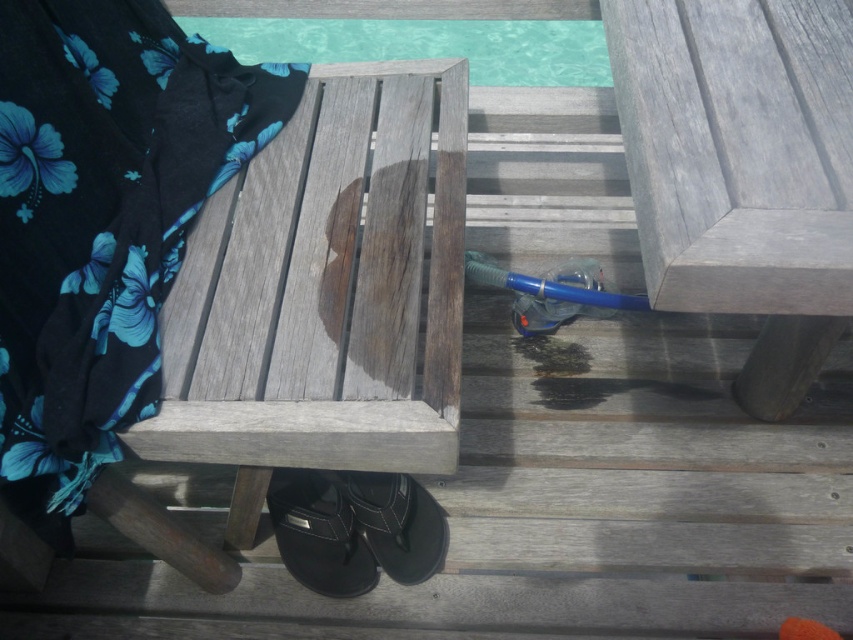
Question: Observing the image, what is the correct spatial positioning of weathered wood bench at center in reference to black leather sandal at lower center?

Choices:
 (A) above
 (B) below

Answer: (A)

Question: Which object is the farthest from the black leather sandal at lower center?

Choices:
 (A) weathered wood bench at center
 (B) clear glass pool at upper center

Answer: (B)

Question: Does weathered wood bench at center have a smaller size compared to black leather sandal at lower center?

Choices:
 (A) no
 (B) yes

Answer: (A)

Question: Among these points, which one is farthest from the camera?

Choices:
 (A) (373, 570)
 (B) (202, 246)
 (C) (434, 48)

Answer: (C)

Question: Does clear glass pool at upper center appear over black leather sandal at lower center?

Choices:
 (A) yes
 (B) no

Answer: (A)

Question: Which point is farther to the camera?

Choices:
 (A) (357, 564)
 (B) (520, 38)

Answer: (B)